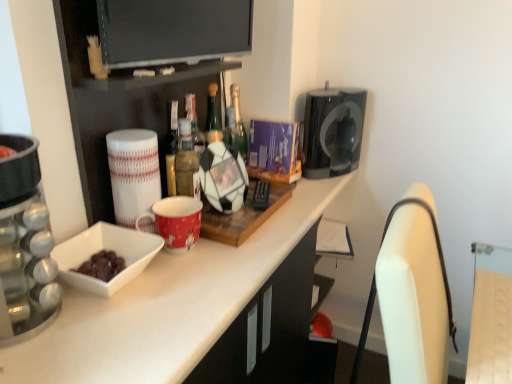
Identify the location of free space in front of red glossy mug at center. The image size is (512, 384). (181, 292).